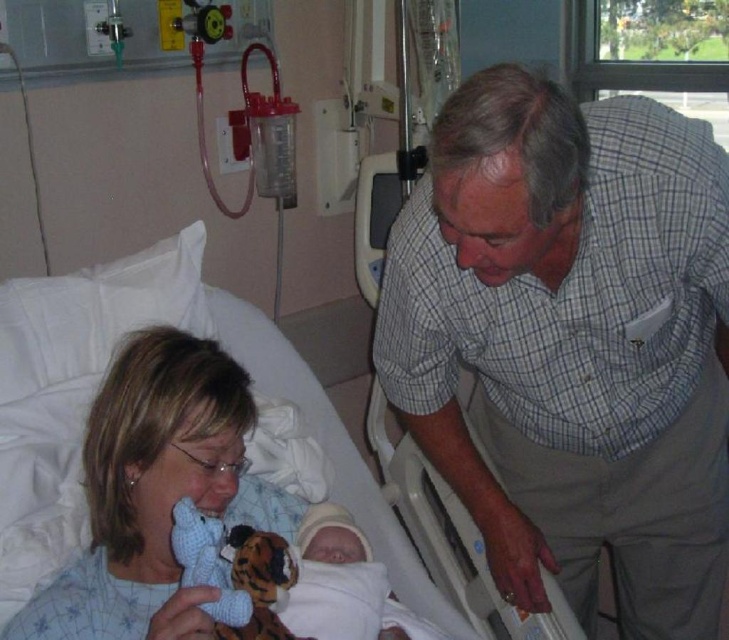
Who is taller, blue fabric at left or knitted blue bear at lower left?

With more height is blue fabric at left.

Is blue fabric at left further to the viewer compared to knitted blue bear at lower left?

No, blue fabric at left is in front of knitted blue bear at lower left.

The height and width of the screenshot is (640, 729). Describe the element at coordinates (155, 490) in the screenshot. I see `blue fabric at left` at that location.

You are a GUI agent. You are given a task and a screenshot of the screen. Output one action in this format:
    pyautogui.click(x=<x>, y=<y>)
    Task: Click on the blue fabric at left
    The image size is (729, 640).
    Given the screenshot: What is the action you would take?
    pyautogui.click(x=155, y=490)

Which is below, soft white blanket at center or knitted blue bear at lower left?

soft white blanket at center

Which is more to the left, soft white blanket at center or knitted blue bear at lower left?

Positioned to the left is knitted blue bear at lower left.

Where is `soft white blanket at center`? soft white blanket at center is located at coordinates (343, 586).

Identify the location of soft white blanket at center. The width and height of the screenshot is (729, 640). (343, 586).

Does gray checkered shirt at upper right appear under rubber teething ring at lower right?

No, gray checkered shirt at upper right is not below rubber teething ring at lower right.

Is gray checkered shirt at upper right bigger than rubber teething ring at lower right?

Correct, gray checkered shirt at upper right is larger in size than rubber teething ring at lower right.

Find the location of `gray checkered shirt at upper right`. gray checkered shirt at upper right is located at coordinates (572, 342).